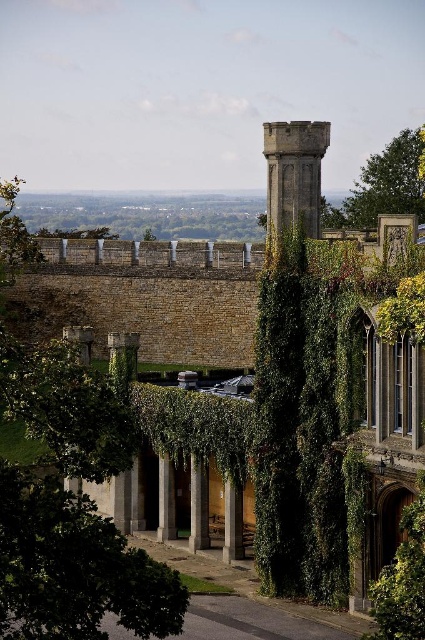
Who is higher up, stone tower at upper center or green leafy tree at upper right?

green leafy tree at upper right is higher up.

Who is lower down, stone tower at upper center or green leafy tree at upper right?

stone tower at upper center is lower down.

Find the location of `stone tower at upper center`. stone tower at upper center is located at coordinates (294, 173).

Can you confirm if green leafy tree at left is thinner than green leafy tree at upper right?

Incorrect, green leafy tree at left's width is not less than green leafy tree at upper right's.

Does point (113, 536) come farther from viewer compared to point (374, 196)?

No, (113, 536) is in front of (374, 196).

At what (x,y) coordinates should I click in order to perform the action: click on green leafy tree at left. Please return your answer as a coordinate pair (x, y). Looking at the image, I should click on (71, 508).

Looking at this image, does green leafy tree at left appear under stone tower at upper center?

Yes, green leafy tree at left is below stone tower at upper center.

Is green leafy tree at left positioned at the back of stone tower at upper center?

No.

Is point (48, 560) positioned in front of point (289, 136)?

Yes, it is in front of point (289, 136).

Where is `green leafy tree at left`? The image size is (425, 640). green leafy tree at left is located at coordinates click(x=71, y=508).